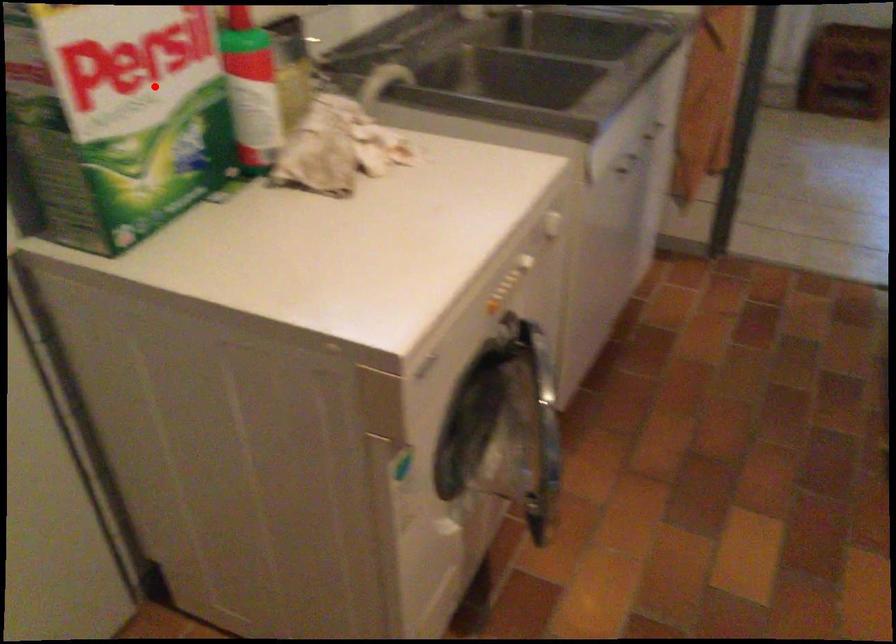
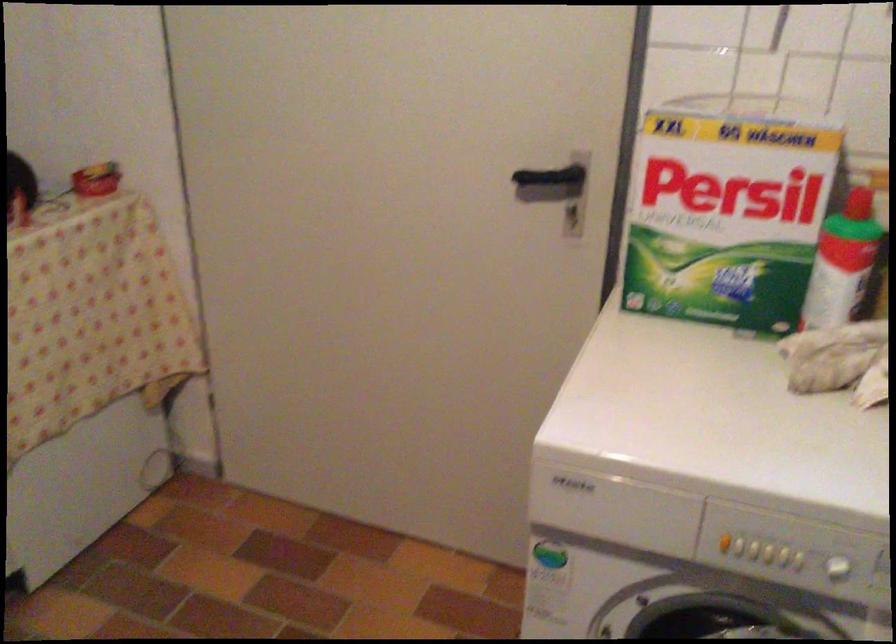
Question: I am providing you with two images of the same scene from different viewpoints. A red point is shown in image1. For the corresponding object point in image2, is it positioned nearer or farther from the camera?

Choices:
 (A) Nearer
 (B) Farther

Answer: (B)